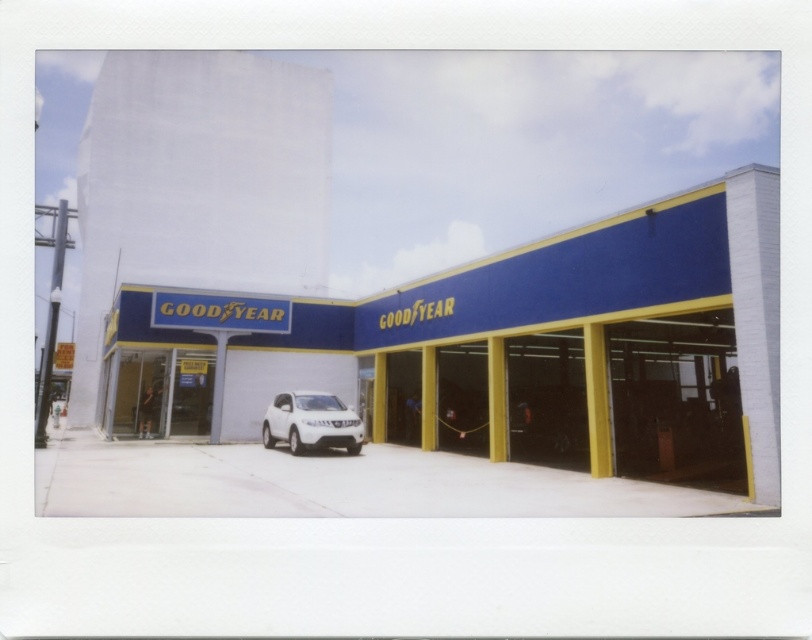
Question: Where is blue/white goodyear sign at center located in relation to white matte suv at center in the image?

Choices:
 (A) below
 (B) above

Answer: (B)

Question: Which point is farther to the camera?

Choices:
 (A) (318, 436)
 (B) (758, 396)

Answer: (A)

Question: Does blue/white goodyear sign at center appear under white matte suv at center?

Choices:
 (A) yes
 (B) no

Answer: (B)

Question: Can you confirm if blue/white goodyear sign at center is positioned below white matte suv at center?

Choices:
 (A) no
 (B) yes

Answer: (A)

Question: Which point is closer to the camera?

Choices:
 (A) white matte suv at center
 (B) blue/white goodyear sign at center

Answer: (B)